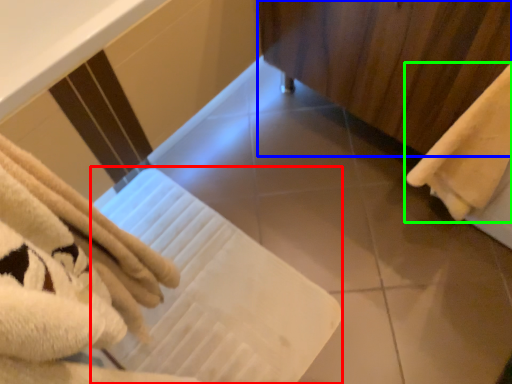
Question: Estimate the real-world distances between objects in this image. Which object is farther from bath towel (highlighted by a red box), curtain (highlighted by a blue box) or towel (highlighted by a green box)?

Choices:
 (A) curtain
 (B) towel

Answer: (A)